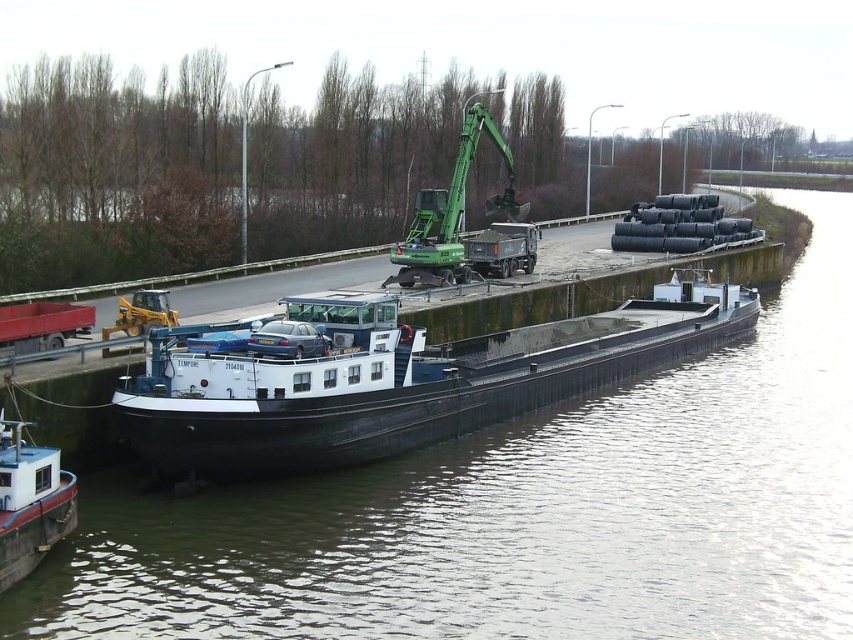
This screenshot has width=853, height=640. What do you see at coordinates (524, 513) in the screenshot?
I see `black rubber tubes at upper center` at bounding box center [524, 513].

Which is more to the left, black rubber tubes at upper center or green metallic crane at center?

green metallic crane at center is more to the left.

What do you see at coordinates (524, 513) in the screenshot?
I see `black rubber tubes at upper center` at bounding box center [524, 513].

Identify the location of black rubber tubes at upper center. This screenshot has width=853, height=640. (524, 513).

Does point (352, 438) come farther from viewer compared to point (439, 268)?

No, (352, 438) is closer to viewer.

At what (x,y) coordinates should I click in order to perform the action: click on black matte barge at center. Please return your answer as a coordinate pair (x, y). The height and width of the screenshot is (640, 853). Looking at the image, I should click on (401, 380).

Find the location of a particular element. Image resolution: width=853 pixels, height=640 pixels. black matte barge at center is located at coordinates (401, 380).

Who is positioned more to the left, black rubber tubes at upper center or black matte barge at center?

black matte barge at center

Does point (688, 378) lie behind point (238, 380)?

Yes, point (688, 378) is behind point (238, 380).

I want to click on black rubber tubes at upper center, so click(524, 513).